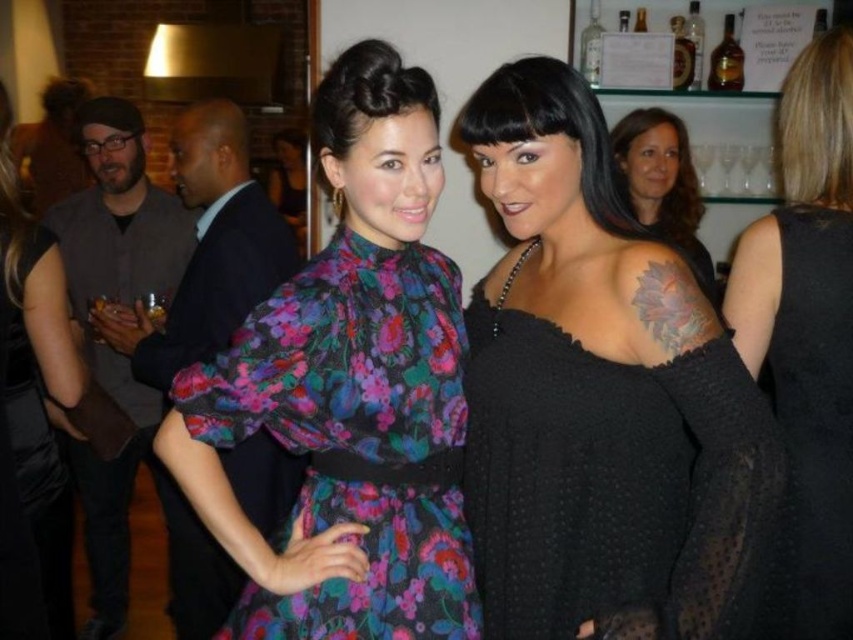
Question: Which of the following is the farthest from the observer?

Choices:
 (A) (312, 417)
 (B) (850, 444)
 (C) (627, 168)
 (D) (10, 474)

Answer: (C)

Question: Which point appears closest to the camera in this image?

Choices:
 (A) (711, 58)
 (B) (370, 481)
 (C) (786, 422)
 (D) (495, 616)

Answer: (B)

Question: Estimate the real-world distances between objects in this image. Which object is farther from the amber glass bottle at upper right?

Choices:
 (A) floral print fabric dress at center
 (B) black dotted sweater at upper center
 (C) black textured dress at upper right

Answer: (A)

Question: Does floral print fabric dress at center appear under dark gray textured sweater at upper right?

Choices:
 (A) yes
 (B) no

Answer: (A)

Question: Does black textured dress at upper right have a lesser width compared to amber glass bottle at upper right?

Choices:
 (A) no
 (B) yes

Answer: (A)

Question: Can you confirm if floral-patterned fabric dress at center is positioned below black textured dress at upper right?

Choices:
 (A) yes
 (B) no

Answer: (B)